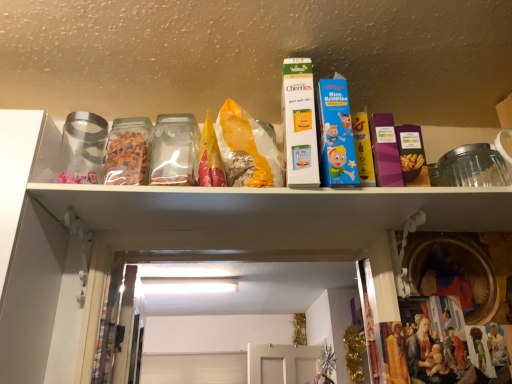
Question: Is white cardboard cheerios box at upper center, which is the first product in left-to-right order, directly adjacent to blue cardboard rice krispies cereal box at center, which is the second product in left-to-right order?

Choices:
 (A) yes
 (B) no

Answer: (A)

Question: From a real-world perspective, is white cardboard cheerios box at upper center, marked as the second product in a right-to-left arrangement, located beneath blue cardboard rice krispies cereal box at center, the 1th product viewed from the right?

Choices:
 (A) yes
 (B) no

Answer: (B)

Question: Considering the relative sizes of white cardboard cheerios box at upper center, marked as the second product in a right-to-left arrangement, and blue cardboard rice krispies cereal box at center, which is the second product in left-to-right order, in the image provided, is white cardboard cheerios box at upper center, marked as the second product in a right-to-left arrangement, bigger than blue cardboard rice krispies cereal box at center, which is the second product in left-to-right order,?

Choices:
 (A) no
 (B) yes

Answer: (B)

Question: Is blue cardboard rice krispies cereal box at center, which is the second product in left-to-right order, a part of white cardboard cheerios box at upper center, marked as the second product in a right-to-left arrangement?

Choices:
 (A) yes
 (B) no

Answer: (B)

Question: Does white cardboard cheerios box at upper center, marked as the second product in a right-to-left arrangement, have a greater height compared to blue cardboard rice krispies cereal box at center, the 1th product viewed from the right?

Choices:
 (A) no
 (B) yes

Answer: (B)

Question: Looking at their shapes, would you say transparent plastic container at center is wider or thinner than blue cardboard rice krispies cereal box at center, the 1th product viewed from the right?

Choices:
 (A) wide
 (B) thin

Answer: (A)

Question: Is transparent plastic container at center inside or outside of blue cardboard rice krispies cereal box at center, the 1th product viewed from the right?

Choices:
 (A) inside
 (B) outside

Answer: (B)

Question: From a real-world perspective, is transparent plastic container at center positioned above or below blue cardboard rice krispies cereal box at center, the 1th product viewed from the right?

Choices:
 (A) above
 (B) below

Answer: (B)

Question: From the image's perspective, relative to blue cardboard rice krispies cereal box at center, the 1th product viewed from the right, is transparent plastic container at center above or below?

Choices:
 (A) below
 (B) above

Answer: (A)

Question: From the image's perspective, is blue cardboard rice krispies cereal box at center, the 1th product viewed from the right, above or below white cardboard cheerios box at upper center, which is the first product in left-to-right order?

Choices:
 (A) above
 (B) below

Answer: (B)

Question: Relative to white cardboard cheerios box at upper center, marked as the second product in a right-to-left arrangement, is blue cardboard rice krispies cereal box at center, which is the second product in left-to-right order, in front or behind?

Choices:
 (A) behind
 (B) front

Answer: (A)

Question: Based on their sizes in the image, would you say blue cardboard rice krispies cereal box at center, the 1th product viewed from the right, is bigger or smaller than white cardboard cheerios box at upper center, marked as the second product in a right-to-left arrangement?

Choices:
 (A) small
 (B) big

Answer: (A)

Question: Considering the positions of point (320, 86) and point (287, 66), is point (320, 86) closer or farther from the camera than point (287, 66)?

Choices:
 (A) closer
 (B) farther

Answer: (A)

Question: Is point (287, 147) positioned closer to the camera than point (172, 163)?

Choices:
 (A) closer
 (B) farther

Answer: (A)

Question: From a real-world perspective, is white cardboard cheerios box at upper center, which is the first product in left-to-right order, positioned above or below transparent plastic container at center?

Choices:
 (A) above
 (B) below

Answer: (A)